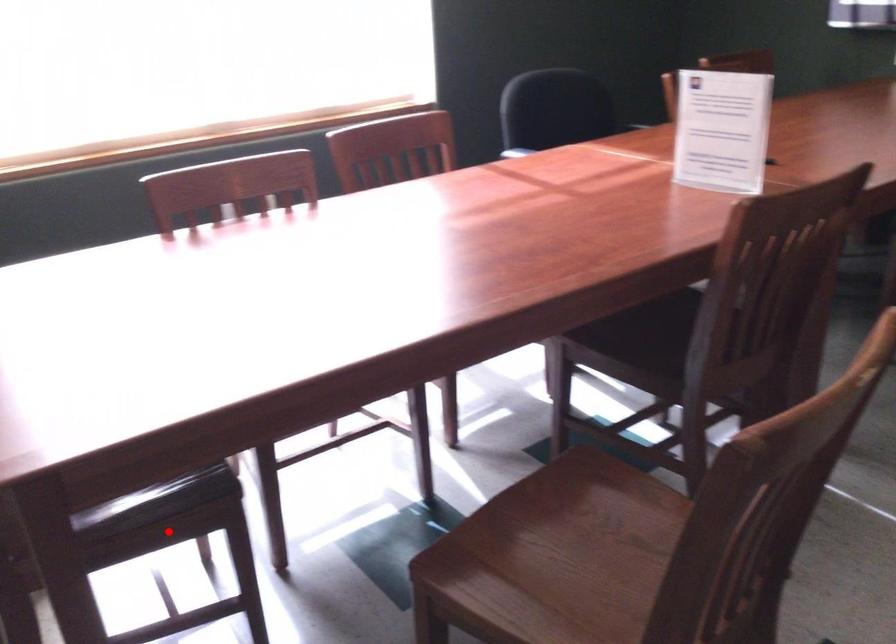
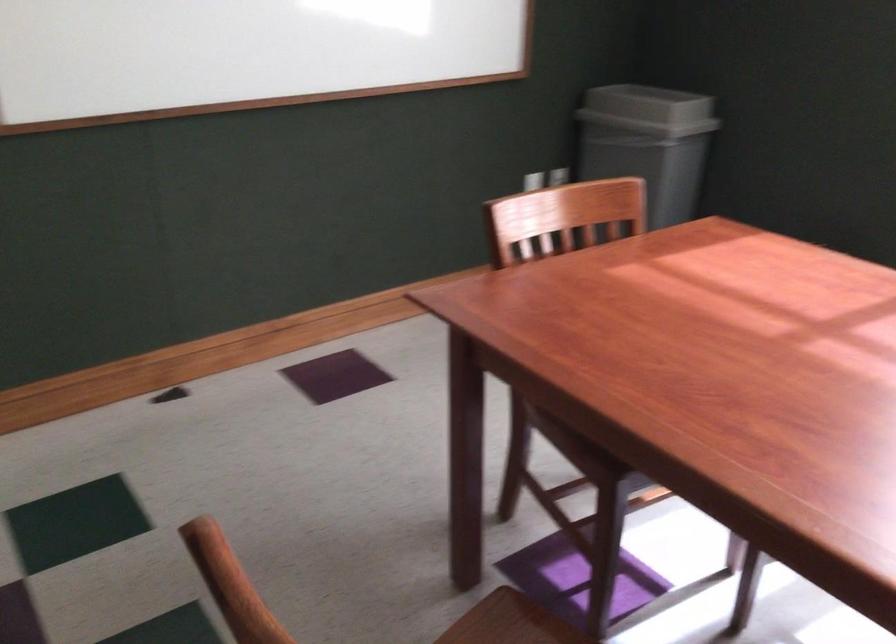
Where in the second image is the point corresponding to the highlighted location from the first image?

(570, 453)